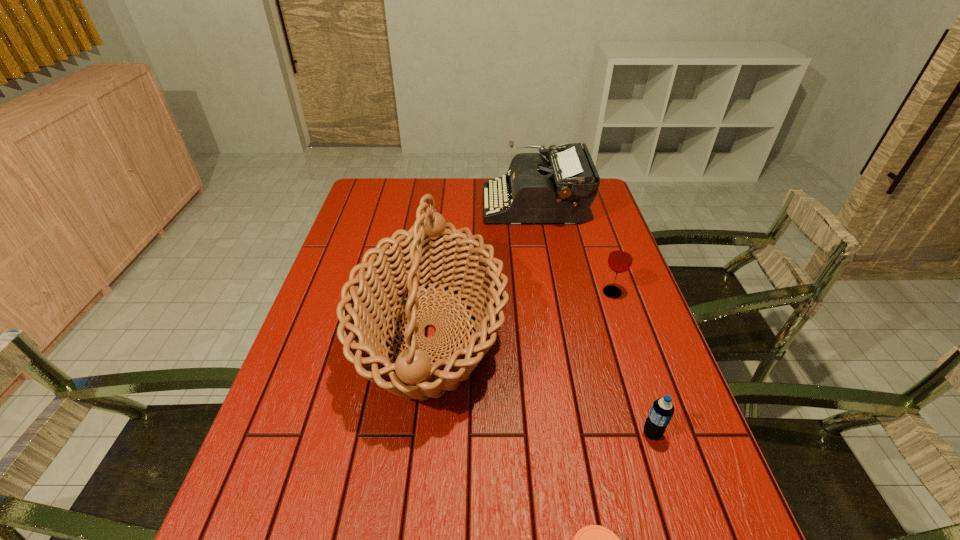
Image resolution: width=960 pixels, height=540 pixels. What are the coordinates of `vacant space that satisfies the following two spatial constraints: 1. on the back side of the second shortest object; 2. on the left side of the third tallest object` in the screenshot? It's located at (607, 293).

This screenshot has width=960, height=540. I want to click on free space in the image that satisfies the following two spatial constraints: 1. on the front-facing side of the typewriter; 2. on the right side of the glass, so pyautogui.click(x=550, y=293).

The image size is (960, 540). Identify the location of vacant area that satisfies the following two spatial constraints: 1. on the front-facing side of the typewriter; 2. on the left side of the soda bottle. (575, 433).

The height and width of the screenshot is (540, 960). I want to click on vacant point that satisfies the following two spatial constraints: 1. on the back side of the third tallest object; 2. on the front-facing side of the typewriter, so click(x=583, y=205).

You are a GUI agent. You are given a task and a screenshot of the screen. Output one action in this format:
    pyautogui.click(x=<x>, y=<y>)
    Task: Click on the free space that satisfies the following two spatial constraints: 1. on the front-facing side of the second shortest object; 2. on the right side of the typewriter
    
    Given the screenshot: What is the action you would take?
    pyautogui.click(x=575, y=433)

Find the location of `free spot that satisfies the following two spatial constraints: 1. on the back side of the soda bottle; 2. on the front-facing side of the typewriter`. free spot that satisfies the following two spatial constraints: 1. on the back side of the soda bottle; 2. on the front-facing side of the typewriter is located at coordinates (579, 205).

The width and height of the screenshot is (960, 540). What are the coordinates of `free space in the image that satisfies the following two spatial constraints: 1. on the back side of the soda bottle; 2. on the front-facing side of the farthest object` in the screenshot? It's located at (579, 205).